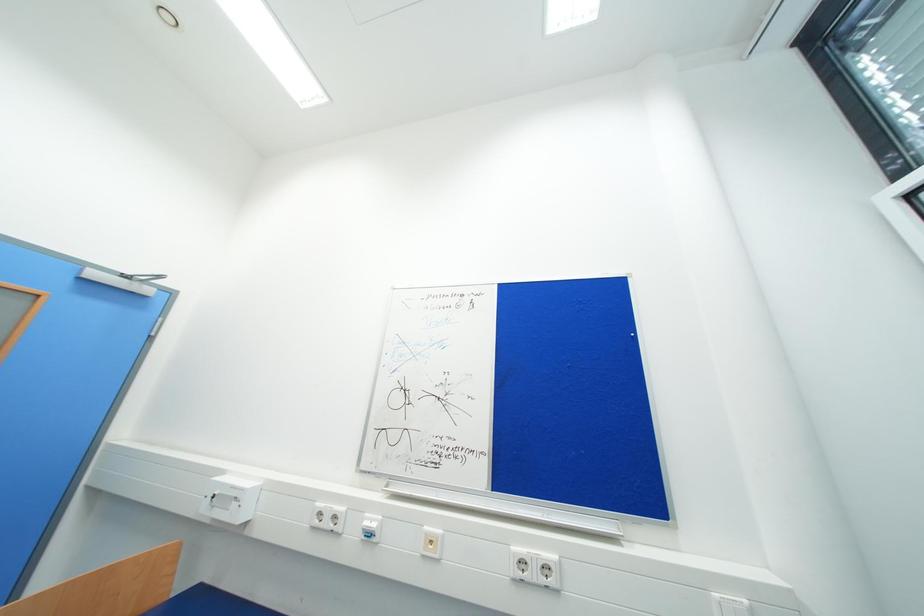
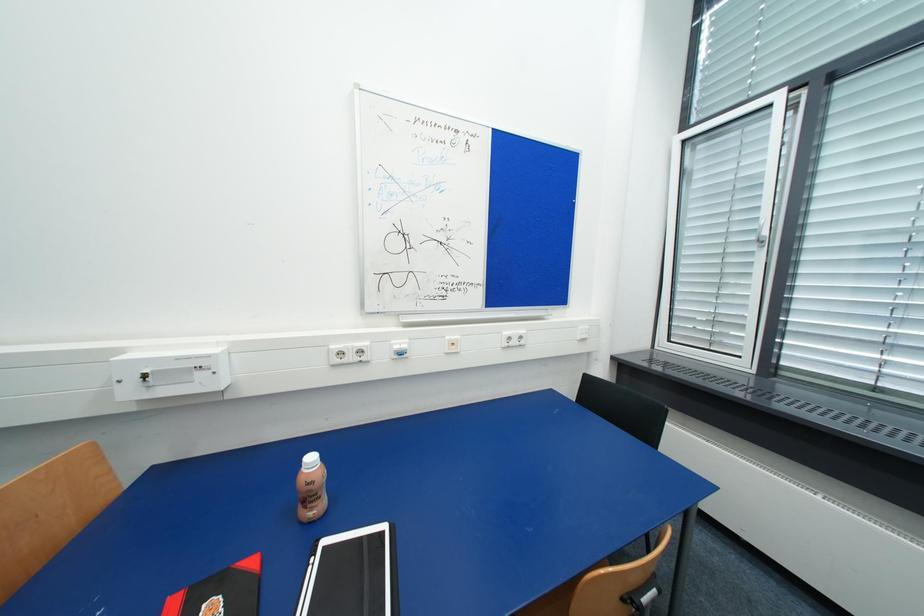
The images are taken continuously from a first-person perspective. In which direction is your viewpoint rotating?

The camera's rotation is toward right-down.